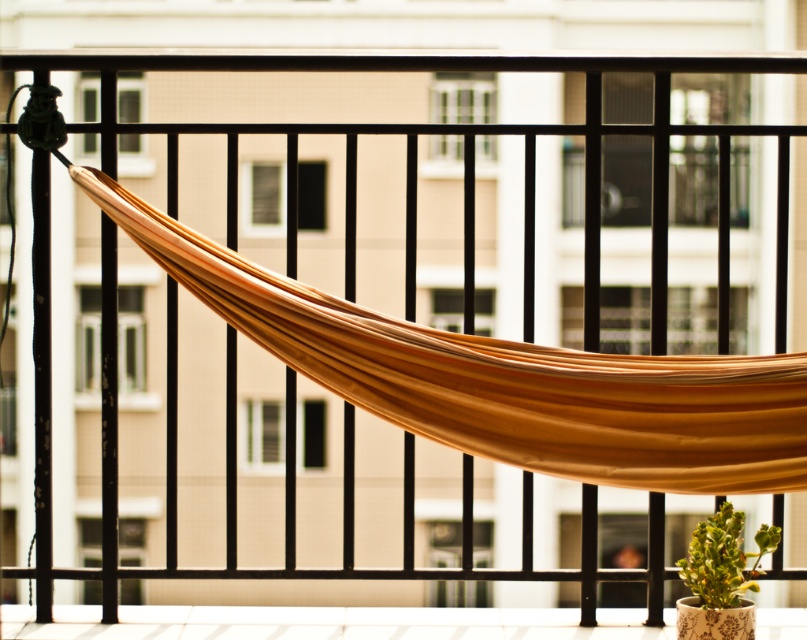
You are standing on the balcony and want to look at two points marked in the image. The first point is at coordinate point (473, 356) and the second point is at coordinate point (703, 536). Which point is closer to you?

Point (473, 356) is in front of point (703, 536), so the first point is closer to you.

You are standing on the balcony and want to place a small potted plant between the brown fabric hammock at center and the green leafy plant at lower right. Based on their current positions, which object should the potted plant be closer to?

The potted plant should be placed closer to the green leafy plant at lower right because the brown fabric hammock at center is positioned on the left side of the green leafy plant at lower right, meaning the hammock is to the left and the plant is to the right. Placing the new plant between them would require it to be closer to the right side where the green leafy plant at lower right is located.